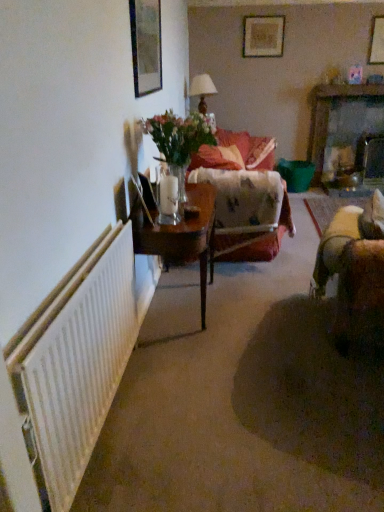
The image size is (384, 512). What do you see at coordinates (178, 141) in the screenshot? I see `clear glass vase at center` at bounding box center [178, 141].

Identify the location of floral-patterned fabric couch at center. The width and height of the screenshot is (384, 512). (229, 151).

Identify the location of wooden table at left. (181, 237).

The image size is (384, 512). What are the coordinates of `matte wooden picture frame at upper center, arranged as the 1th picture frame when ordered from the bottom` in the screenshot? It's located at (146, 46).

Find the location of a particular element. clear glass vase at center is located at coordinates (178, 141).

In the scene shown: Would you say wooden dresser at upper right is to the left or to the right of fluffy fabric couch at center in the picture?

Clearly, wooden dresser at upper right is on the right of fluffy fabric couch at center in the image.

Does wooden dresser at upper right touch fluffy fabric couch at center?

No, wooden dresser at upper right is not making contact with fluffy fabric couch at center.

Consider the image. From the image's perspective, does wooden dresser at upper right appear lower than fluffy fabric couch at center?

No, from the image's perspective, wooden dresser at upper right is not below fluffy fabric couch at center.

Is fluffy fabric couch at center at the back of wooden dresser at upper right?

That's not correct — wooden dresser at upper right is not looking away from fluffy fabric couch at center.

Visually, is matte brown table lamp at center positioned to the left or to the right of clear glass vase at center?

Clearly, matte brown table lamp at center is on the right of clear glass vase at center in the image.

Looking at this image, from the image's perspective, who appears lower, matte brown table lamp at center or clear glass vase at center?

From the image's view, clear glass vase at center is below.

Looking at this image, considering the sizes of matte brown table lamp at center and clear glass vase at center in the image, is matte brown table lamp at center wider or thinner than clear glass vase at center?

Considering their sizes, matte brown table lamp at center looks slimmer than clear glass vase at center.

Considering the points (273, 41) and (271, 164), which point is in front, point (273, 41) or point (271, 164)?

The point (271, 164) is in front.

Considering the positions of objects wooden picture frame at upper center, placed as the first picture frame when sorted from top to bottom, and fluffy fabric couch at center in the image provided, who is behind, wooden picture frame at upper center, placed as the first picture frame when sorted from top to bottom, or fluffy fabric couch at center?

wooden picture frame at upper center, placed as the first picture frame when sorted from top to bottom, is further from the camera.

Is wooden picture frame at upper center, which ranks as the second picture frame in right-to-left order, with fluffy fabric couch at center?

No, wooden picture frame at upper center, which ranks as the second picture frame in right-to-left order, is not next to fluffy fabric couch at center.

Can you tell me how much wooden picture frame at upper center, the 3th picture frame from the bottom, and fluffy fabric couch at center differ in facing direction?

They differ by 27.7 degrees in their facing directions.

From a real-world perspective, who is located higher, fluffy fabric couch at center or wooden dresser at upper right?

From a 3D spatial view, fluffy fabric couch at center is above.

Does fluffy fabric couch at center have a greater width compared to wooden dresser at upper right?

Indeed, fluffy fabric couch at center has a greater width compared to wooden dresser at upper right.

Is fluffy fabric couch at center completely or partially outside of wooden dresser at upper right?

Yes, fluffy fabric couch at center is located beyond the bounds of wooden dresser at upper right.

From a real-world perspective, which object rests below the other?

white ribbed radiator at left, from a real-world perspective.

From the image's perspective, is matte brown table lamp at center below white ribbed radiator at left?

No.

This screenshot has width=384, height=512. What are the coordinates of `radiator that is under the matte brown table lamp at center (from a real-world perspective)` in the screenshot? It's located at (81, 369).

Which of these two, clear glass vase at center or wooden picture frame at upper center, which ranks as the second picture frame in right-to-left order, is smaller?

wooden picture frame at upper center, which ranks as the second picture frame in right-to-left order.

Considering the relative positions of clear glass vase at center and wooden picture frame at upper center, the 3th picture frame from the bottom, in the image provided, is clear glass vase at center behind wooden picture frame at upper center, the 3th picture frame from the bottom,?

No, it is not.

Is clear glass vase at center wider or thinner than wooden picture frame at upper center, which ranks as the second picture frame in right-to-left order?

In the image, clear glass vase at center appears to be wider than wooden picture frame at upper center, which ranks as the second picture frame in right-to-left order.

Is wooden dresser at upper right at the left side of wooden table at left?

No.

Considering the relative sizes of wooden dresser at upper right and wooden table at left in the image provided, is wooden dresser at upper right taller than wooden table at left?

Indeed, wooden dresser at upper right has a greater height compared to wooden table at left.

Would you say wooden dresser at upper right is inside or outside wooden table at left?

wooden dresser at upper right is located beyond the bounds of wooden table at left.

Is wooden dresser at upper right bigger or smaller than wooden table at left?

In the image, wooden dresser at upper right appears to be smaller than wooden table at left.

I want to click on dresser above the fluffy fabric couch at center (from the image's perspective), so [328, 115].

This screenshot has width=384, height=512. Identify the location of floral arrangement located underneath the matte brown table lamp at center (from a real-world perspective). (178, 141).

Considering their positions, is matte brown table lamp at center positioned closer to floral-patterned fabric couch at center than wooden dresser at upper right?

matte brown table lamp at center is closer to floral-patterned fabric couch at center.

From the image, which object appears to be nearer to matte wooden picture frame at upper center, which is the third picture frame in right-to-left order, clear glass vase at center or wooden dresser at upper right?

clear glass vase at center is closer to matte wooden picture frame at upper center, which is the third picture frame in right-to-left order.

From the image, which object appears to be farther from white ribbed radiator at left, wooden picture frame at upper center, the first picture frame from the back, or matte wooden picture frame at upper center, arranged as the 1th picture frame when ordered from the bottom?

Based on the image, wooden picture frame at upper center, the first picture frame from the back, appears to be further to white ribbed radiator at left.

From the image, which object appears to be nearer to fluffy fabric couch at center, wooden dresser at upper right or wooden picture frame at upper center, which ranks as the second picture frame in right-to-left order?

wooden dresser at upper right is closer to fluffy fabric couch at center.

Looking at the image, which one is located closer to matte brown table lamp at center, white ribbed radiator at left or wooden table at left?

Among the two, wooden table at left is located nearer to matte brown table lamp at center.

From the picture: When comparing their distances from matte wooden picture frame at upper center, acting as the 3th picture frame starting from the top, does wooden dresser at upper right or clear glass vase at center seem closer?

clear glass vase at center is closer to matte wooden picture frame at upper center, acting as the 3th picture frame starting from the top.

From the picture: Looking at the image, which one is located further to matte wooden picture frame at upper center, the first picture frame positioned from the left, matte brown table lamp at center or transparent glass table at center?

Based on the image, transparent glass table at center appears to be further to matte wooden picture frame at upper center, the first picture frame positioned from the left.

When comparing their distances from wooden picture frame at upper center, the 3th picture frame from the bottom, does matte wooden picture frame at upper center, which is the third picture frame in right-to-left order, or wooden picture frame at upper right, positioned as the 2th picture frame in top-to-bottom order, seem closer?

wooden picture frame at upper right, positioned as the 2th picture frame in top-to-bottom order, lies closer to wooden picture frame at upper center, the 3th picture frame from the bottom, than the other object.

Where is `studio couch between matte wooden picture frame at upper center, the first picture frame positioned from the left, and transparent glass table at center from front to back`? studio couch between matte wooden picture frame at upper center, the first picture frame positioned from the left, and transparent glass table at center from front to back is located at coordinates (229, 151).

Find the location of `floral arrangement between white ribbed radiator at left and matte brown table lamp at center in the front-back direction`. floral arrangement between white ribbed radiator at left and matte brown table lamp at center in the front-back direction is located at coordinates (178, 141).

You are a GUI agent. You are given a task and a screenshot of the screen. Output one action in this format:
    pyautogui.click(x=<x>, y=<y>)
    Task: Click on the studio couch between matte wooden picture frame at upper center, arranged as the 1th picture frame when ordered from the bottom, and matte brown table lamp at center from front to back
    The width and height of the screenshot is (384, 512).
    Given the screenshot: What is the action you would take?
    pyautogui.click(x=229, y=151)

Identify the location of picture frame positioned between wooden table at left and matte brown table lamp at center from near to far. Image resolution: width=384 pixels, height=512 pixels. [x=146, y=46].